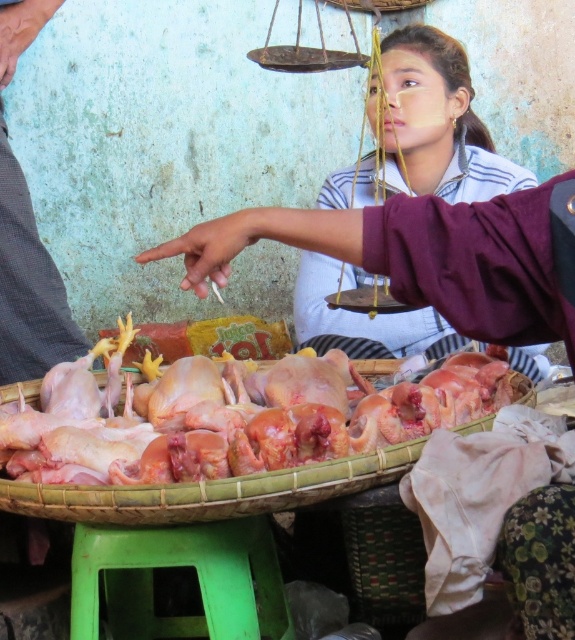
Does green plastic stool at lower center appear on the left side of metallic scale at upper center?

Indeed, green plastic stool at lower center is positioned on the left side of metallic scale at upper center.

Is point (177, 628) behind point (354, 51)?

No, it is not.

The image size is (575, 640). What are the coordinates of `green plastic stool at lower center` in the screenshot? It's located at click(x=174, y=566).

Is raw pink meat at center above metallic scale at upper center?

No, raw pink meat at center is not above metallic scale at upper center.

This screenshot has height=640, width=575. Identify the location of raw pink meat at center. (239, 419).

Which is in front, point (305, 426) or point (338, 58)?

Point (305, 426) is more forward.

This screenshot has height=640, width=575. I want to click on raw pink meat at center, so click(x=239, y=419).

Is blue striped shirt at center smaller than metallic scale at upper center?

Actually, blue striped shirt at center might be larger than metallic scale at upper center.

Can you confirm if blue striped shirt at center is bigger than metallic scale at upper center?

Yes, blue striped shirt at center is bigger than metallic scale at upper center.

Locate an element on the screen. The image size is (575, 640). blue striped shirt at center is located at coordinates (438, 122).

The image size is (575, 640). Identify the location of blue striped shirt at center. (438, 122).